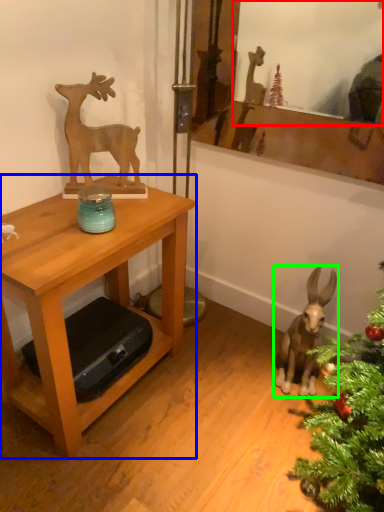
Question: Which is farther away from mirror (highlighted by a red box)? table (highlighted by a blue box) or animal (highlighted by a green box)?

Choices:
 (A) table
 (B) animal

Answer: (B)